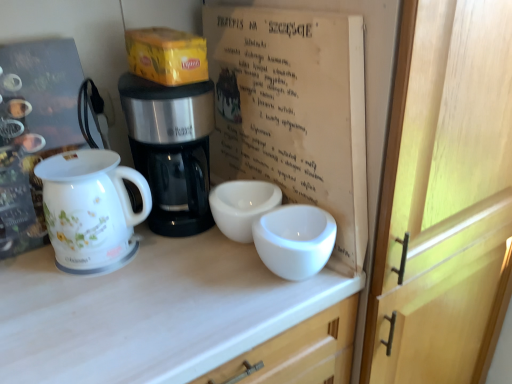
Question: Is white glossy jug at left a part of white paper at center?

Choices:
 (A) no
 (B) yes

Answer: (A)

Question: From the image's perspective, is white paper at center below white glossy jug at left?

Choices:
 (A) no
 (B) yes

Answer: (A)

Question: Is white paper at center further to the viewer compared to white glossy jug at left?

Choices:
 (A) no
 (B) yes

Answer: (A)

Question: Is white paper at center taller than white glossy jug at left?

Choices:
 (A) no
 (B) yes

Answer: (B)

Question: Does white paper at center have a larger size compared to white glossy jug at left?

Choices:
 (A) no
 (B) yes

Answer: (B)

Question: Can you confirm if white paper at center is shorter than white glossy jug at left?

Choices:
 (A) yes
 (B) no

Answer: (B)

Question: Is white glossy jug at left thinner than yellow cardboard box at upper center?

Choices:
 (A) yes
 (B) no

Answer: (A)

Question: Does white glossy jug at left turn towards yellow cardboard box at upper center?

Choices:
 (A) yes
 (B) no

Answer: (B)

Question: From a real-world perspective, is white glossy jug at left positioned over yellow cardboard box at upper center based on gravity?

Choices:
 (A) no
 (B) yes

Answer: (A)

Question: Is white glossy jug at left outside yellow cardboard box at upper center?

Choices:
 (A) no
 (B) yes

Answer: (B)

Question: Does white glossy jug at left have a greater height compared to yellow cardboard box at upper center?

Choices:
 (A) yes
 (B) no

Answer: (A)

Question: Considering the relative positions of white glossy jug at left and yellow cardboard box at upper center in the image provided, is white glossy jug at left in front of yellow cardboard box at upper center?

Choices:
 (A) no
 (B) yes

Answer: (B)

Question: Is the depth of yellow cardboard box at upper center less than that of black plastic coffee maker at center?

Choices:
 (A) no
 (B) yes

Answer: (A)